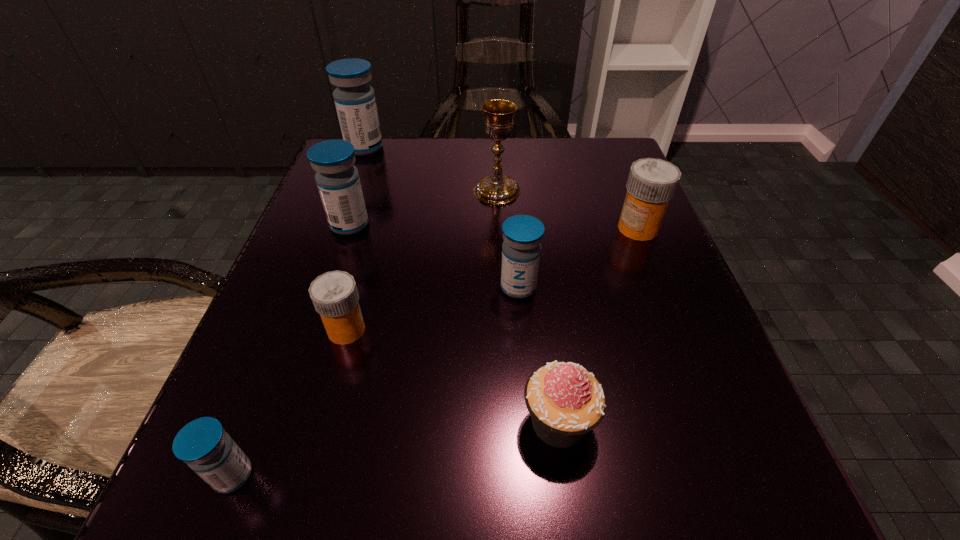
Identify the location of the farthest blue medicine. Image resolution: width=960 pixels, height=540 pixels. (355, 102).

What are the coordinates of `the farthest object` in the screenshot? It's located at (355, 102).

Identify the location of the second farthest object. (496, 189).

Find the location of a particular element. This screenshot has height=540, width=960. the second farthest blue medicine is located at coordinates (338, 181).

Where is `the third tallest object`? the third tallest object is located at coordinates (338, 181).

Identify the location of the bigger orange medicine. (651, 183).

The height and width of the screenshot is (540, 960). In order to click on the rightmost medicine in this screenshot , I will do `click(651, 183)`.

Find the location of `the fourth nearest object`. the fourth nearest object is located at coordinates (522, 234).

You are a GUI agent. You are given a task and a screenshot of the screen. Output one action in this format:
    pyautogui.click(x=<x>, y=<y>)
    Task: Click on the rightmost blue medicine
    Image resolution: width=960 pixels, height=540 pixels.
    Given the screenshot: What is the action you would take?
    pyautogui.click(x=522, y=234)

What are the coordinates of `pink cupcake` in the screenshot? It's located at (566, 401).